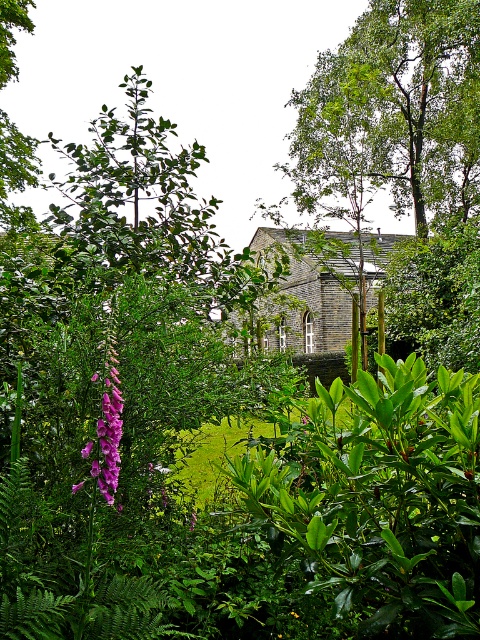
Can you confirm if green glossy bush at center is positioned below purple silky flower at left?

Indeed, green glossy bush at center is positioned under purple silky flower at left.

Is green glossy bush at center smaller than purple silky flower at left?

Incorrect, green glossy bush at center is not smaller in size than purple silky flower at left.

Is point (333, 525) behind point (107, 456)?

That is True.

Where is `green glossy bush at center`? green glossy bush at center is located at coordinates (379, 499).